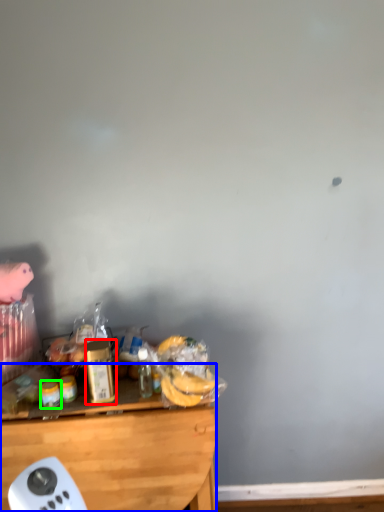
Question: Estimate the real-world distances between objects in this image. Which object is closer to bottle (highlighted by a red box), desk (highlighted by a blue box) or food (highlighted by a green box)?

Choices:
 (A) desk
 (B) food

Answer: (B)